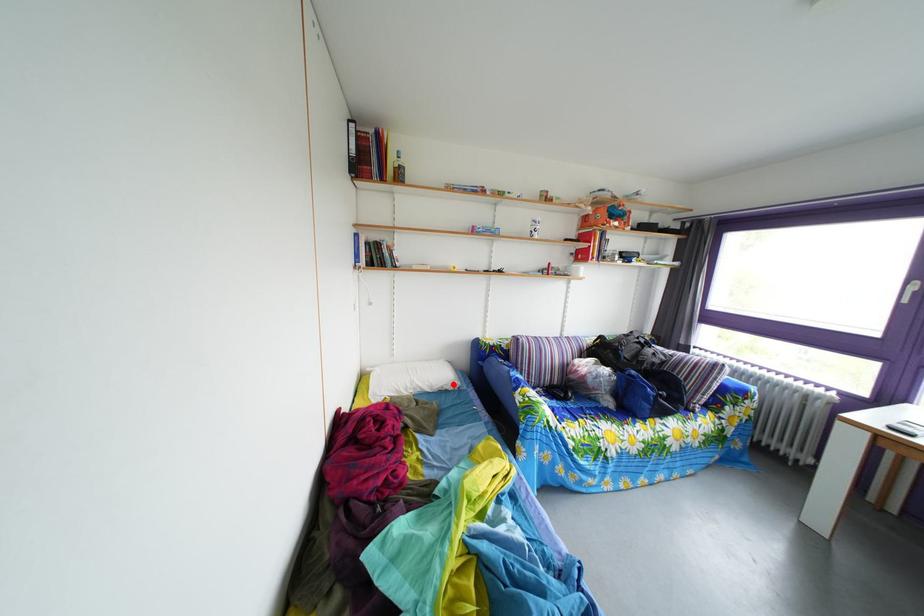
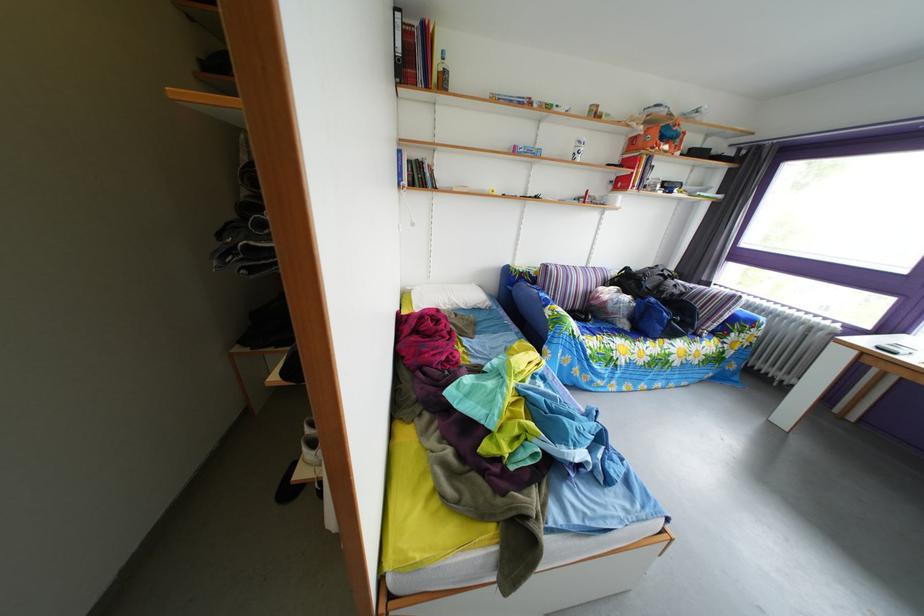
Question: A red point is marked in image1. In image2, is the corresponding 3D point closer to the camera or farther? Reply with the corresponding letter.

Choices:
 (A) The corresponding 3D point is closer.
 (B) The corresponding 3D point is farther.

Answer: (A)